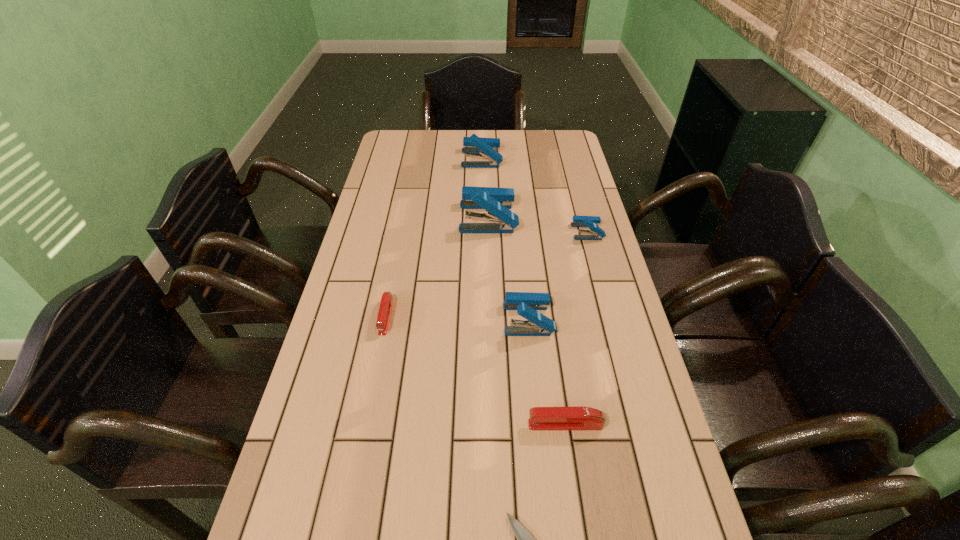
The image size is (960, 540). I want to click on the second closest red stapler to the second tallest object, so click(541, 418).

Find the location of a particular element. free point that satisfies the following two spatial constraints: 1. on the front-facing side of the left red stapler; 2. on the left side of the fifth shortest object is located at coordinates (385, 319).